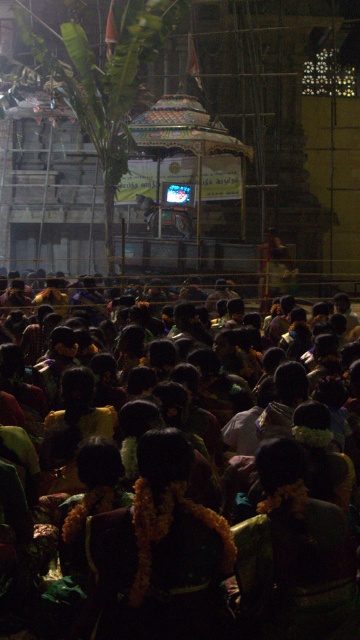
What do you see at coordinates (216, 552) in the screenshot? This screenshot has height=640, width=360. I see `green fabric at center` at bounding box center [216, 552].

Where is `green fabric at center`? The width and height of the screenshot is (360, 640). green fabric at center is located at coordinates (216, 552).

Does point (290, 614) come farther from viewer compared to point (218, 552)?

That is False.

At what (x,y) coordinates should I click in order to perform the action: click on green fabric at center. Please return your answer as a coordinate pair (x, y). The width and height of the screenshot is (360, 640). Looking at the image, I should click on (216, 552).